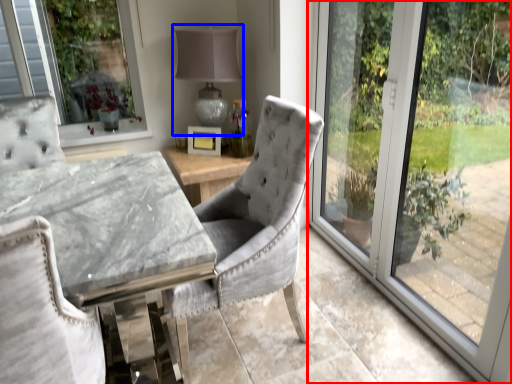
Question: Which object appears farthest to the camera in this image, window (highlighted by a red box) or table lamp (highlighted by a blue box)?

Choices:
 (A) window
 (B) table lamp

Answer: (B)